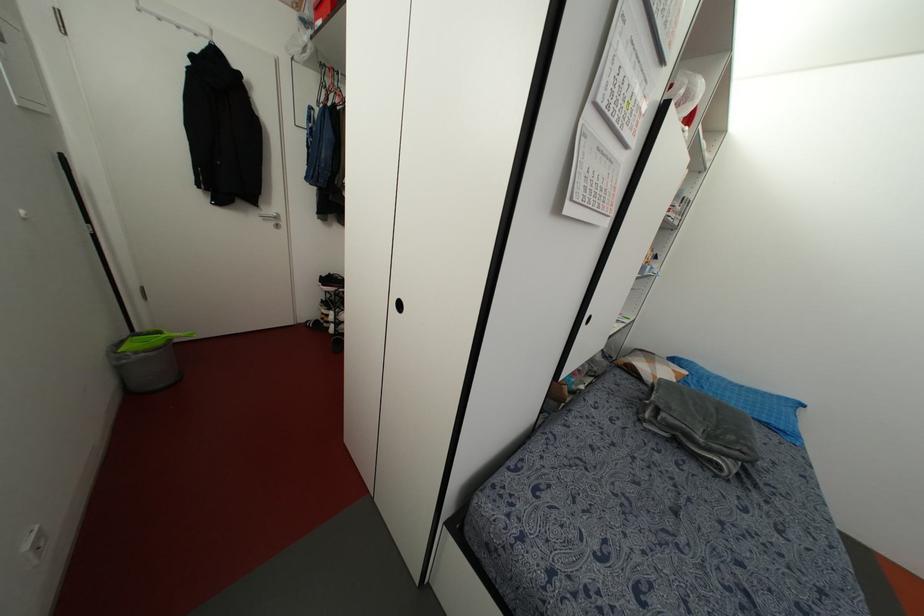
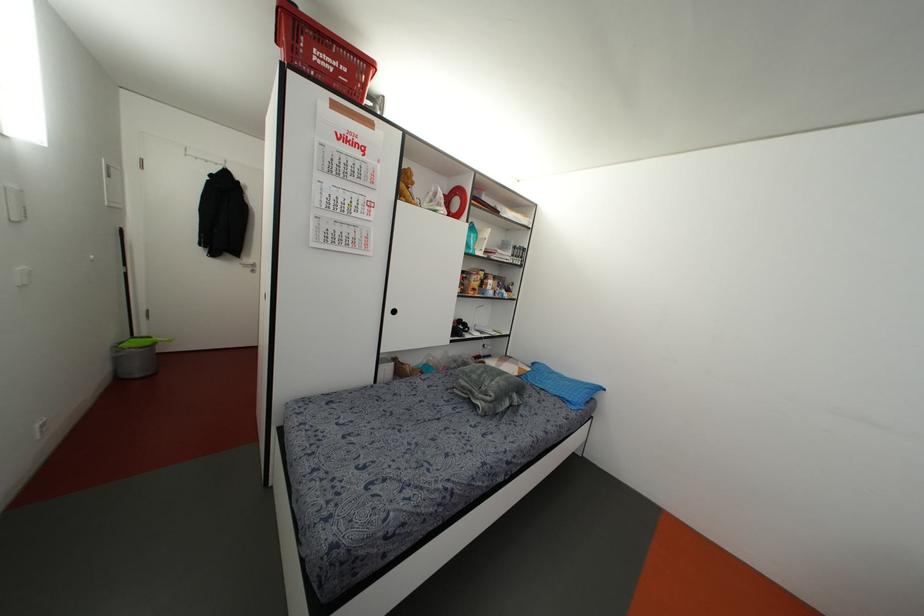
Find the pixel in the second image that matches (x=168, y=339) in the first image.

(153, 342)